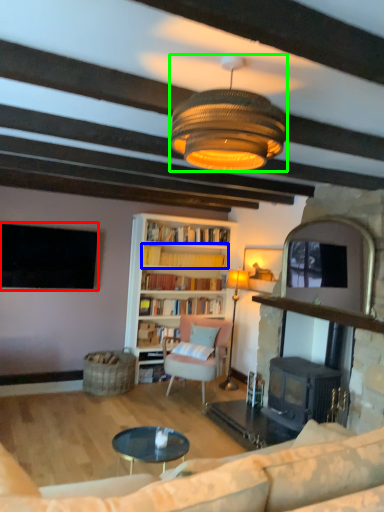
Question: Which is nearer to the television (highlighted by a red box)? book (highlighted by a blue box) or lamp (highlighted by a green box).

Choices:
 (A) book
 (B) lamp

Answer: (A)